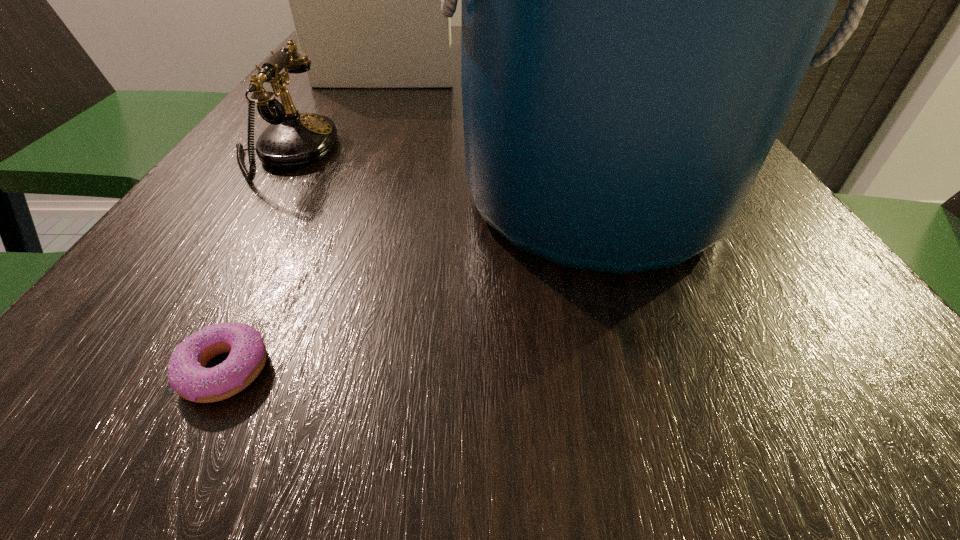
This screenshot has width=960, height=540. I want to click on the farthest object, so click(365, 0).

Identify the location of the rightmost object. (641, 0).

The height and width of the screenshot is (540, 960). What are the coordinates of `telephone` in the screenshot? It's located at (292, 140).

Find the location of a particular element. Image resolution: width=960 pixels, height=540 pixels. the nearest object is located at coordinates (187, 375).

Find the location of a particular element. doughnut is located at coordinates (187, 375).

This screenshot has height=540, width=960. Find the location of `free space located on the right of the cake`. free space located on the right of the cake is located at coordinates (607, 60).

Where is `vacant region located on the left of the bucket`? Image resolution: width=960 pixels, height=540 pixels. vacant region located on the left of the bucket is located at coordinates (276, 197).

The width and height of the screenshot is (960, 540). I want to click on free region located on the dial of the second shortest object, so click(514, 152).

You are a GUI agent. You are given a task and a screenshot of the screen. Output one action in this format:
    pyautogui.click(x=<x>, y=<y>)
    Task: Click on the vacant region located 0.350m on the right of the shortest object
    
    Given the screenshot: What is the action you would take?
    pyautogui.click(x=632, y=370)

I want to click on object that is at the far edge, so click(365, 0).